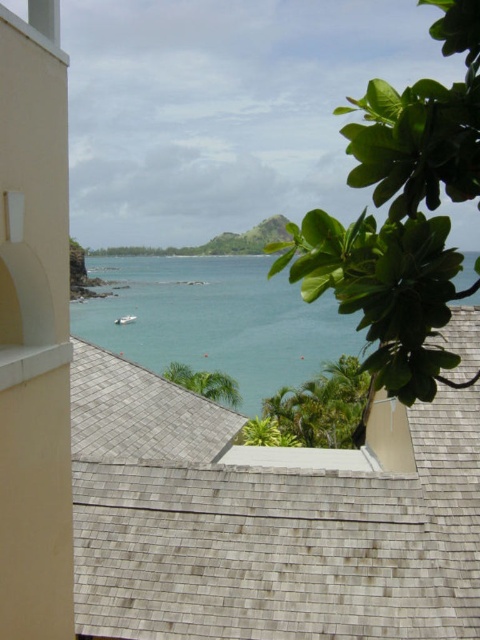
Question: Which of these objects is positioned closest to the clear blue water at center?

Choices:
 (A) white matte boat at center
 (B) gray shingles at center

Answer: (A)

Question: Considering the relative positions of gray shingles at center and clear blue water at center in the image provided, where is gray shingles at center located with respect to clear blue water at center?

Choices:
 (A) below
 (B) above

Answer: (A)

Question: Can you confirm if gray shingles at center is positioned to the right of clear blue water at center?

Choices:
 (A) no
 (B) yes

Answer: (A)

Question: Is the position of gray shingles at center more distant than that of white matte boat at center?

Choices:
 (A) yes
 (B) no

Answer: (B)

Question: Which of the following is the closest to the observer?

Choices:
 (A) white matte boat at center
 (B) clear blue water at center

Answer: (B)

Question: Which object appears closest to the camera in this image?

Choices:
 (A) white matte boat at center
 (B) clear blue water at center

Answer: (B)